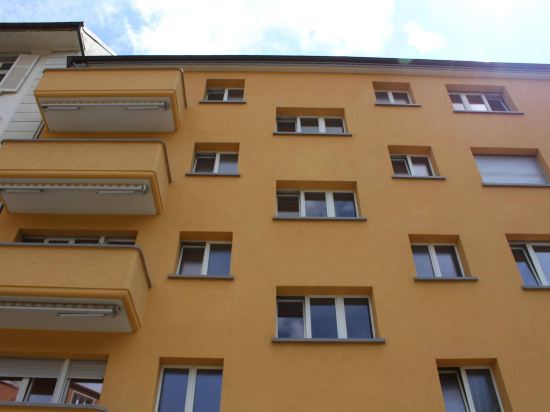
This screenshot has height=412, width=550. Find the location of `wooden window shutter`. wooden window shutter is located at coordinates (18, 70).